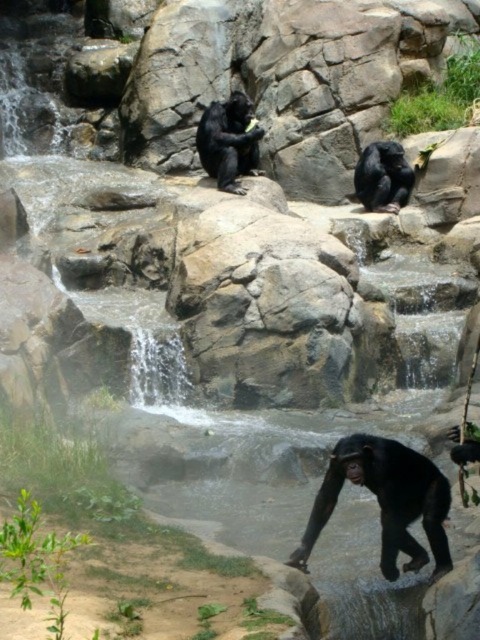
You are a zookeeper observing the chimpanzees near the waterfall. You need to place a feeding tray exactly at point 0.783, 0.804. Is the black glossy monkey at lower center in a position to easily reach the feeding tray once placed?

The black glossy monkey at lower center is located at point (x=385, y=500), so yes, the monkey will be able to easily reach the feeding tray once placed there.

You are a zookeeper who needs to place a feeding tray between the black matte monkey at center and the black matte monkey at upper center. The tray requires 7 feet of space. Can you fit it between them?

The distance between the black matte monkey at center and the black matte monkey at upper center is 8.05 feet, so yes, the feeding tray requiring 7 feet of space can fit between them since the available space is greater than the required space.